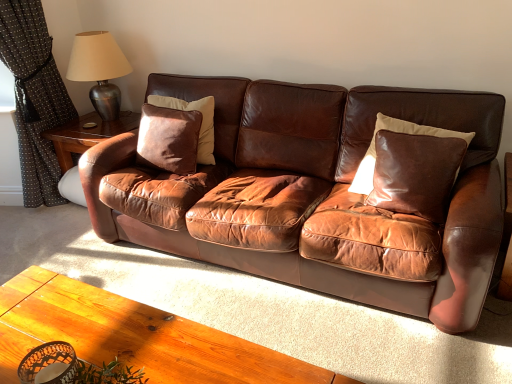
Question: Does black dotted fabric at left lie behind brown leather couch at center?

Choices:
 (A) no
 (B) yes

Answer: (B)

Question: Is black dotted fabric at left thinner than brown leather couch at center?

Choices:
 (A) no
 (B) yes

Answer: (B)

Question: Is black dotted fabric at left not within brown leather couch at center?

Choices:
 (A) yes
 (B) no

Answer: (A)

Question: Is black dotted fabric at left placed right next to brown leather couch at center?

Choices:
 (A) no
 (B) yes

Answer: (A)

Question: Is black dotted fabric at left surrounding brown leather couch at center?

Choices:
 (A) yes
 (B) no

Answer: (B)

Question: Is shiny brown leather pillow at right, acting as the first pillow starting from the right, inside or outside of suede-like brown pillow at center-left, acting as the 1th pillow starting from the left?

Choices:
 (A) outside
 (B) inside

Answer: (A)

Question: From their relative heights in the image, would you say shiny brown leather pillow at right, which ranks as the 2th pillow in left-to-right order, is taller or shorter than suede-like brown pillow at center-left, acting as the 1th pillow starting from the left?

Choices:
 (A) short
 (B) tall

Answer: (B)

Question: In the image, is shiny brown leather pillow at right, acting as the first pillow starting from the right, positioned in front of or behind suede-like brown pillow at center-left, which is the 2th pillow in right-to-left order?

Choices:
 (A) behind
 (B) front

Answer: (B)

Question: Would you say shiny brown leather pillow at right, which ranks as the 2th pillow in left-to-right order, is to the left or to the right of suede-like brown pillow at center-left, which is the 2th pillow in right-to-left order, in the picture?

Choices:
 (A) right
 (B) left

Answer: (A)

Question: Is suede-like brown pillow at center-left, acting as the 1th pillow starting from the left, in front of or behind metallic silver table lamp at upper left in the image?

Choices:
 (A) front
 (B) behind

Answer: (A)

Question: Looking at their shapes, would you say suede-like brown pillow at center-left, which is the 2th pillow in right-to-left order, is wider or thinner than metallic silver table lamp at upper left?

Choices:
 (A) thin
 (B) wide

Answer: (A)

Question: From a real-world perspective, relative to metallic silver table lamp at upper left, is suede-like brown pillow at center-left, which is the 2th pillow in right-to-left order, vertically above or below?

Choices:
 (A) above
 (B) below

Answer: (B)

Question: Is point (211, 134) positioned closer to the camera than point (114, 99)?

Choices:
 (A) closer
 (B) farther

Answer: (A)

Question: Considering the positions of shiny brown leather pillow at right, acting as the first pillow starting from the right, and metallic silver table lamp at upper left in the image, is shiny brown leather pillow at right, acting as the first pillow starting from the right, taller or shorter than metallic silver table lamp at upper left?

Choices:
 (A) tall
 (B) short

Answer: (B)

Question: Is shiny brown leather pillow at right, acting as the first pillow starting from the right, bigger or smaller than metallic silver table lamp at upper left?

Choices:
 (A) big
 (B) small

Answer: (B)